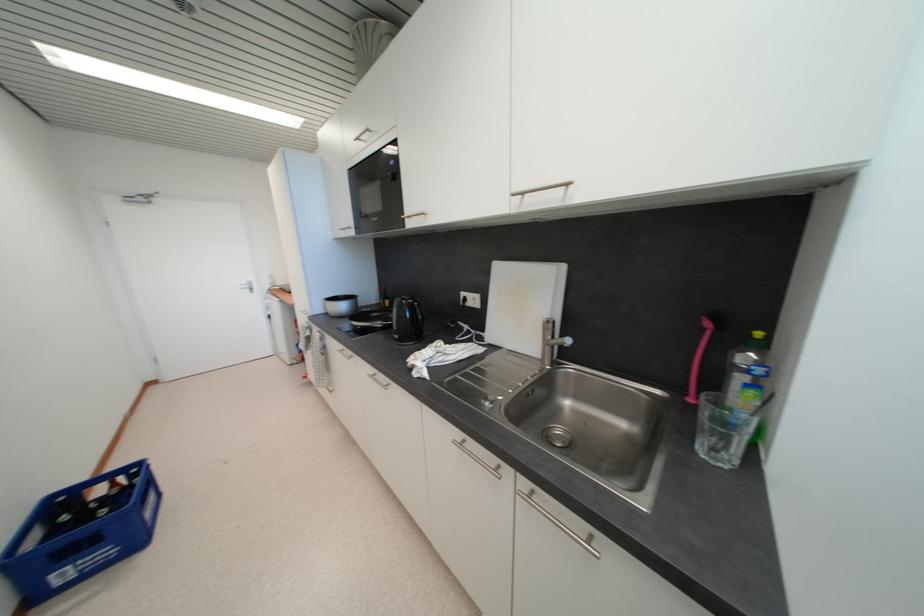
Where would you grasp the pink brush handle? Please return your answer as a coordinate pair (x, y).

(699, 358)